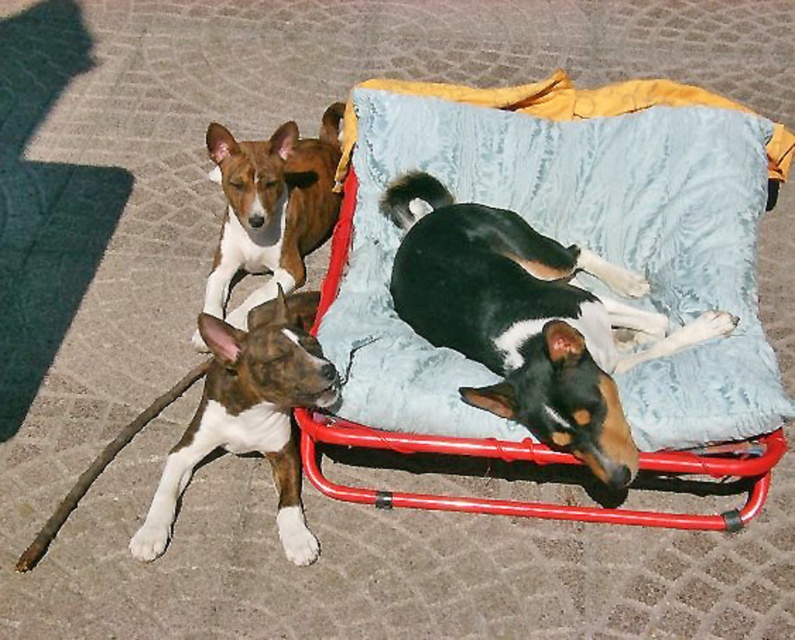
Is point (565, 404) less distant than point (282, 188)?

Yes, it is.

Can you confirm if black and white fur at center is taller than brown/white fur dog at upper left?

Indeed, black and white fur at center has a greater height compared to brown/white fur dog at upper left.

Between point (460, 298) and point (249, 260), which one is positioned behind?

The point (249, 260) is behind.

You are a GUI agent. You are given a task and a screenshot of the screen. Output one action in this format:
    pyautogui.click(x=<x>, y=<y>)
    Task: Click on the black and white fur at center
    The height and width of the screenshot is (640, 795).
    Given the screenshot: What is the action you would take?
    pyautogui.click(x=526, y=320)

Which is more to the left, brown and white fur at lower left or brown/white fur dog at upper left?

brown/white fur dog at upper left

Locate an element on the screen. brown and white fur at lower left is located at coordinates (250, 413).

Locate an element on the screen. This screenshot has height=640, width=795. brown and white fur at lower left is located at coordinates (250, 413).

The image size is (795, 640). What are the coordinates of `brown and white fur at lower left` in the screenshot? It's located at (250, 413).

Where is `brown and white fur at lower left`? brown and white fur at lower left is located at coordinates (250, 413).